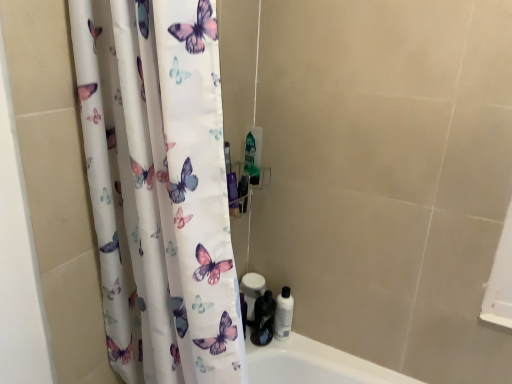
Question: Is shiny black bottle at lower right, positioned as the 2th toiletry in right-to-left order, bigger or smaller than white matte toilet paper at lower center?

Choices:
 (A) small
 (B) big

Answer: (A)

Question: Is point (258, 321) positioned closer to the camera than point (245, 283)?

Choices:
 (A) farther
 (B) closer

Answer: (B)

Question: Based on their relative distances, which object is farther from the white glossy bottle at lower right, which is the 1th toiletry from right to left?

Choices:
 (A) shiny black bottle at lower right, the first toiletry viewed from the left
 (B) white matte toilet paper at lower center

Answer: (B)

Question: Which is farther from the white glossy bottle at lower right, which is the 1th toiletry from right to left?

Choices:
 (A) white matte toilet paper at lower center
 (B) shiny black bottle at lower right, positioned as the 2th toiletry in right-to-left order

Answer: (A)